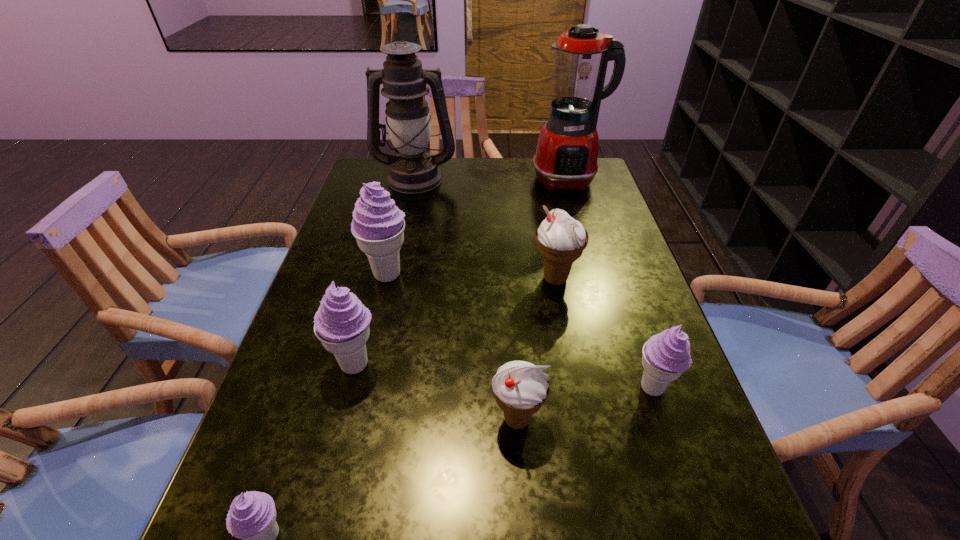
Locate an element on the screen. The image size is (960, 540). the third biggest purple icecream is located at coordinates (666, 356).

At what (x,y) coordinates should I click in order to perform the action: click on free spot located 0.230m on the controls of the food processor. Please return your answer as a coordinate pair (x, y). The image size is (960, 540). Looking at the image, I should click on (586, 244).

In order to click on free point located 0.130m on the right of the blue oil lamp in this screenshot , I will do `click(497, 178)`.

The height and width of the screenshot is (540, 960). What are the coordinates of `vacant area situated 0.340m on the front of the tallest icecream` in the screenshot? It's located at (351, 427).

Find the location of `free location located on the left of the bigger white icecream`. free location located on the left of the bigger white icecream is located at coordinates (493, 279).

I want to click on vacant area located on the back of the third smallest purple icecream, so click(382, 260).

The height and width of the screenshot is (540, 960). What are the coordinates of `free spot located on the back of the smaller white icecream` in the screenshot? It's located at (510, 320).

I want to click on blank space located 0.400m on the left of the third biggest purple icecream, so tap(418, 388).

The height and width of the screenshot is (540, 960). What are the coordinates of `food processor that is positioned at the far edge` in the screenshot? It's located at (566, 156).

Where is `oil lamp situated at the far edge`? The height and width of the screenshot is (540, 960). oil lamp situated at the far edge is located at coordinates (x=413, y=170).